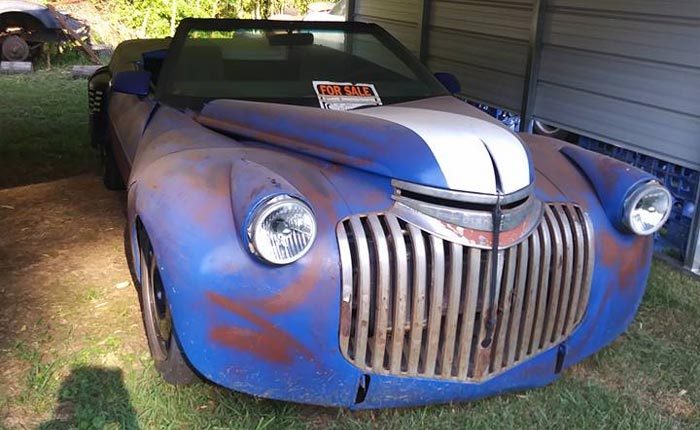
At what (x,y) coordinates should I click in order to perform the action: click on hood. Please return your answer as a coordinate pair (x, y). This screenshot has height=430, width=700. Looking at the image, I should click on (433, 139).